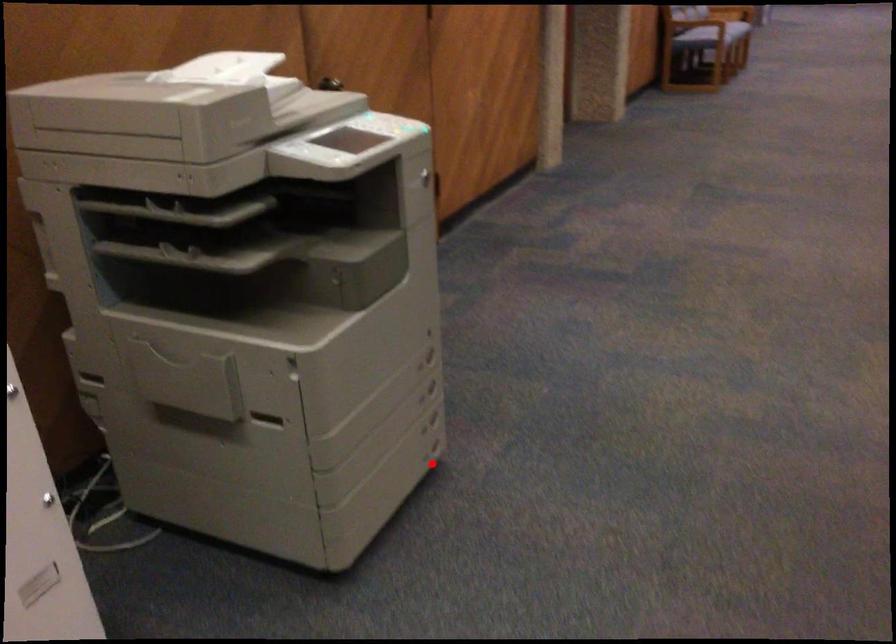
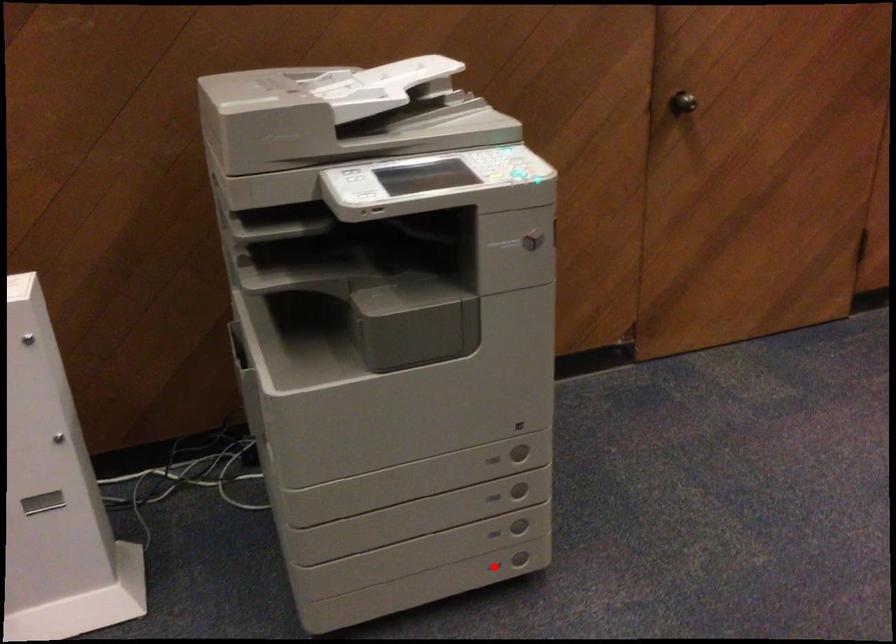
I am providing you with two images of the same scene from different viewpoints. A red point is marked on the first image and another point is marked on the second image. Does the point marked in image1 correspond to the same location as the one in image2?

Yes